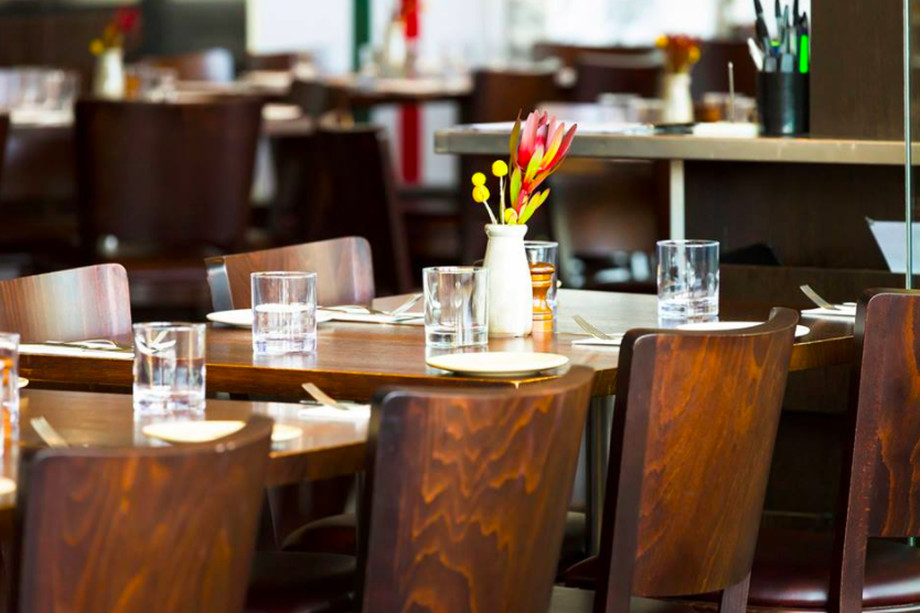
Where is `chairs`? This screenshot has height=613, width=920. chairs is located at coordinates (185, 508), (431, 468), (707, 440), (884, 403), (320, 265), (99, 300).